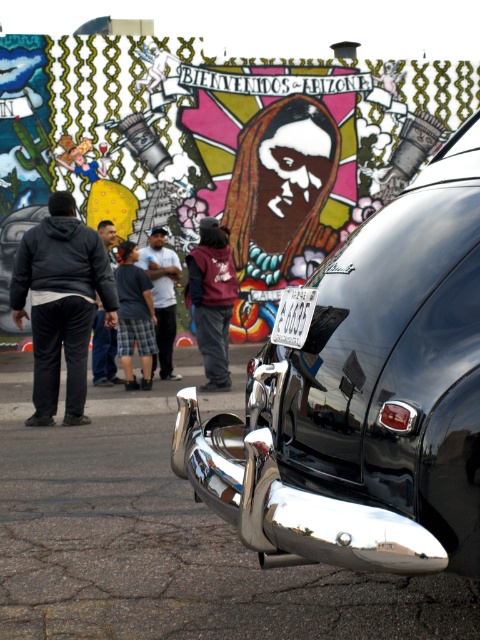
In the scene shown: Does black cotton pants at left have a lesser height compared to white plastic license plate at center?

In fact, black cotton pants at left may be taller than white plastic license plate at center.

Which is in front, point (36, 280) or point (275, 323)?

Point (36, 280) is in front.

Who is more distant from viewer, (38, 275) or (288, 292)?

Point (38, 275)

This screenshot has width=480, height=640. I want to click on black cotton pants at left, so click(x=60, y=304).

Can you confirm if white cotton shirt at center is positioned above white plastic license plate at center?

Correct, white cotton shirt at center is located above white plastic license plate at center.

Does white cotton shirt at center appear under white plastic license plate at center?

No.

Is point (176, 257) less distant than point (295, 339)?

That is False.

This screenshot has width=480, height=640. I want to click on white cotton shirt at center, so click(162, 296).

From the picture: Is polished chrome bumper at center shorter than matte black car at lower right?

Incorrect, polished chrome bumper at center's height does not fall short of matte black car at lower right's.

Is polished chrome bumper at center positioned at the back of matte black car at lower right?

No, polished chrome bumper at center is in front of matte black car at lower right.

Identify the location of polished chrome bumper at center. The image size is (480, 640). (365, 397).

The width and height of the screenshot is (480, 640). I want to click on polished chrome bumper at center, so click(365, 397).